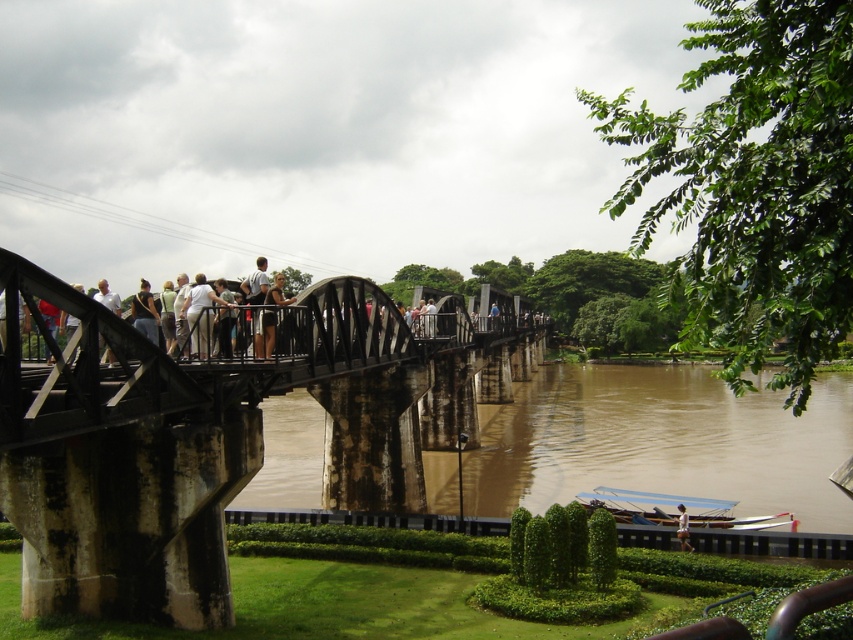
You are standing at the point marked as point (190, 308) on the historic railway bridge. If you want to take a photo of the bridge and the river below, which direction should you face to ensure both are in the frame?

Since the point (190, 308) is 157.05 feet away from the viewer, you should face towards the bridge and river to include both in your photo.

You are standing at point (x=267, y=292) on the historic railway bridge. You want to walk to point (x=593, y=500). Which direction should you move relative to your current position?

You should move backward because point (x=593, y=500) is behind point (x=267, y=292).

You are standing on the historic railway bridge and want to determine which of the two points, point (209,317) or point (276,276), is closer to you. Can you identify the closer point?

Point (209,317) is closer to the viewer than point (276,276).